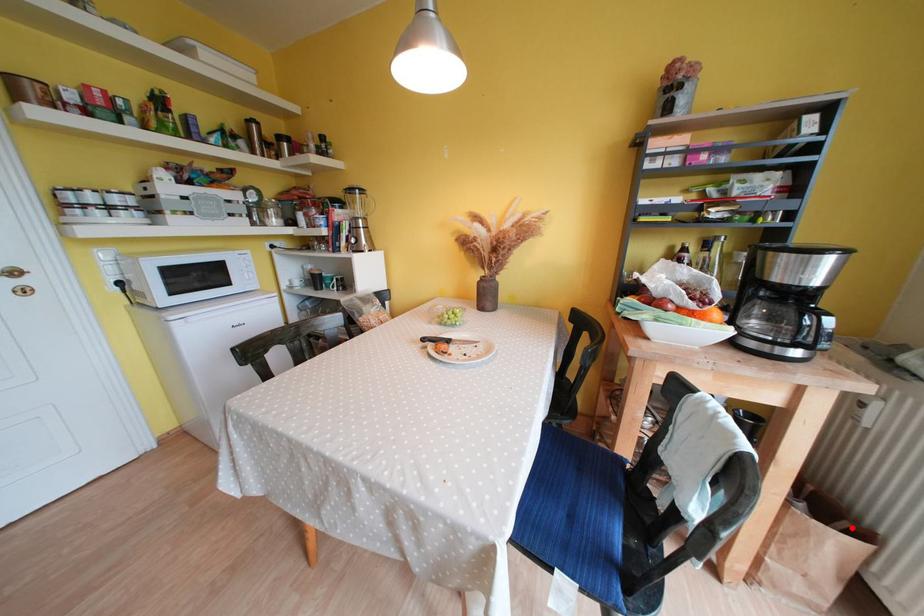
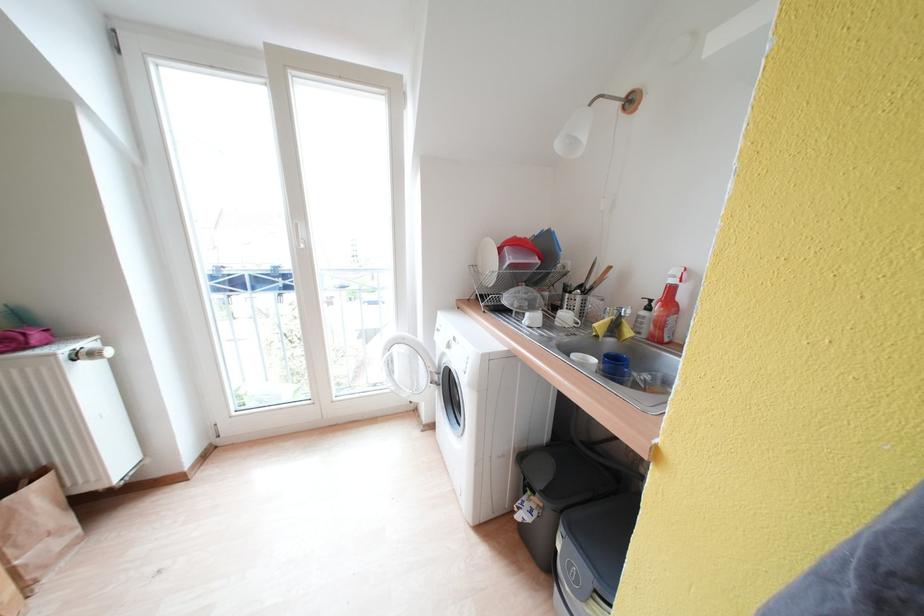
Find the pixel in the second image that matches the highlighted location in the first image.

(30, 485)